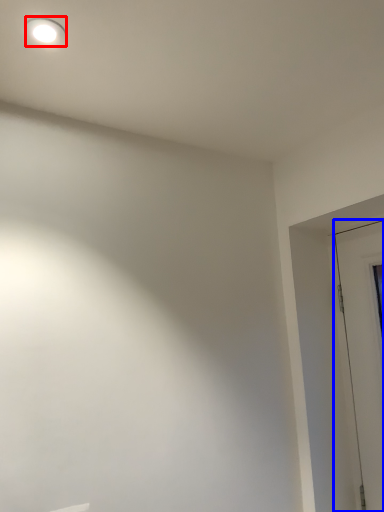
Question: Which object is further to the camera taking this photo, lighting (highlighted by a red box) or door (highlighted by a blue box)?

Choices:
 (A) lighting
 (B) door

Answer: (B)